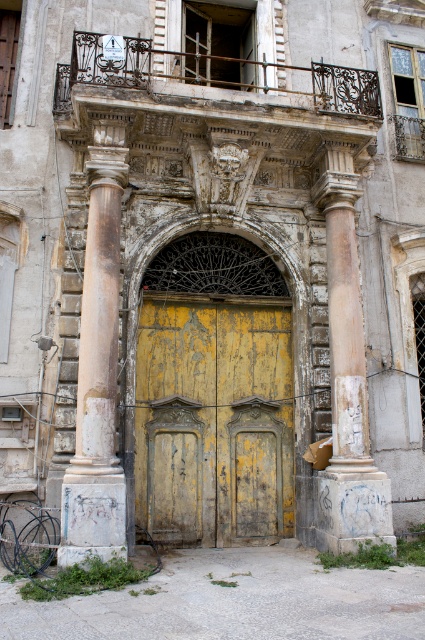
Is yellow weathered wood door at center behind white stone column at left?

Yes.

Between yellow weathered wood door at center and white stone column at left, which one appears on the left side from the viewer's perspective?

From the viewer's perspective, white stone column at left appears more on the left side.

At what (x,y) coordinates should I click in order to perform the action: click on yellow weathered wood door at center. Please return your answer as a coordinate pair (x, y). Image resolution: width=425 pixels, height=640 pixels. Looking at the image, I should click on (214, 420).

Which of these two, yellow weathered wood door at center or white marble column at center, stands taller?

white marble column at center

Describe the element at coordinates (214, 420) in the screenshot. I see `yellow weathered wood door at center` at that location.

Which is behind, point (226, 307) or point (354, 186)?

The point (226, 307) is more distant.

Identify the location of yellow weathered wood door at center. (214, 420).

Between white stone column at left and white marble column at center, which one has less height?

Standing shorter between the two is white stone column at left.

Is white stone column at left wider than white marble column at center?

No.

Where is `white stone column at left`? The height and width of the screenshot is (640, 425). white stone column at left is located at coordinates (98, 365).